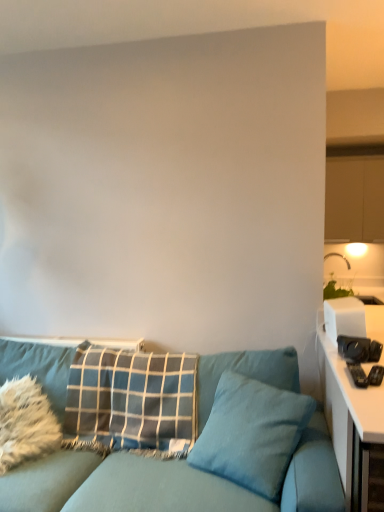
Question: Can you confirm if blue plaid pillow at center, the second pillow when ordered from right to left, is wider than white glossy table at right?

Choices:
 (A) no
 (B) yes

Answer: (A)

Question: Can you confirm if blue plaid pillow at center, the second pillow when ordered from right to left, is positioned to the left of white glossy table at right?

Choices:
 (A) yes
 (B) no

Answer: (A)

Question: Is blue plaid pillow at center, the 2th pillow from the left, outside white glossy table at right?

Choices:
 (A) no
 (B) yes

Answer: (B)

Question: Is blue plaid pillow at center, the second pillow when ordered from right to left, looking in the opposite direction of white glossy table at right?

Choices:
 (A) yes
 (B) no

Answer: (B)

Question: Considering the relative sizes of blue plaid pillow at center, the 2th pillow from the left, and white glossy table at right in the image provided, is blue plaid pillow at center, the 2th pillow from the left, bigger than white glossy table at right?

Choices:
 (A) no
 (B) yes

Answer: (A)

Question: Is the surface of blue plaid pillow at center, the 2th pillow from the left, in direct contact with white glossy table at right?

Choices:
 (A) no
 (B) yes

Answer: (A)

Question: Is teal fabric pillow at center, arranged as the 1th pillow when viewed from the right, facing towards blue plaid pillow at center, the 2th pillow from the left?

Choices:
 (A) yes
 (B) no

Answer: (B)

Question: Is teal fabric pillow at center, which is the 3th pillow from left to right, bigger than blue plaid pillow at center, the 2th pillow from the left?

Choices:
 (A) no
 (B) yes

Answer: (A)

Question: Is teal fabric pillow at center, which is the 3th pillow from left to right, taller than blue plaid pillow at center, the 2th pillow from the left?

Choices:
 (A) no
 (B) yes

Answer: (A)

Question: Is teal fabric pillow at center, arranged as the 1th pillow when viewed from the right, smaller than blue plaid pillow at center, the second pillow when ordered from right to left?

Choices:
 (A) no
 (B) yes

Answer: (B)

Question: Is blue plaid pillow at center, the 2th pillow from the left, inside teal fabric pillow at center, which is the 3th pillow from left to right?

Choices:
 (A) no
 (B) yes

Answer: (A)

Question: Is teal fabric pillow at center, arranged as the 1th pillow when viewed from the right, touching blue plaid pillow at center, the second pillow when ordered from right to left?

Choices:
 (A) yes
 (B) no

Answer: (B)

Question: From the image's perspective, is blue plaid pillow at center, the 2th pillow from the left, located beneath teal fabric pillow at center, arranged as the 1th pillow when viewed from the right?

Choices:
 (A) yes
 (B) no

Answer: (B)